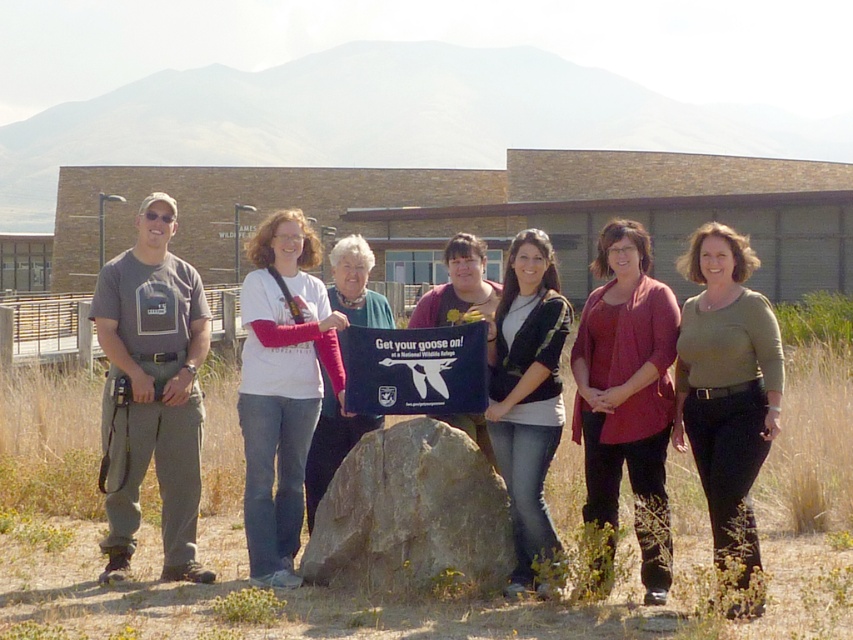
Question: Which object is positioned closest to the gray rock at center?

Choices:
 (A) blue fabric sign at center
 (B) white cotton shirt at center
 (C) matte black shirt at center
 (D) matte red blouse at center

Answer: (A)

Question: Which point is closer to the camera taking this photo?

Choices:
 (A) click(x=701, y=269)
 (B) click(x=492, y=496)
 (C) click(x=497, y=348)
 (D) click(x=276, y=284)

Answer: (A)

Question: Does gray cotton t-shirt at left appear on the left side of blue fabric sign at center?

Choices:
 (A) yes
 (B) no

Answer: (A)

Question: Which of the following is the farthest from the observer?

Choices:
 (A) (368, 374)
 (B) (758, 448)
 (C) (318, 566)

Answer: (A)

Question: Can you confirm if matte red blouse at center is thinner than green matte shirt at center?

Choices:
 (A) no
 (B) yes

Answer: (B)

Question: Does white cotton shirt at center lie in front of matte black shirt at center?

Choices:
 (A) yes
 (B) no

Answer: (A)